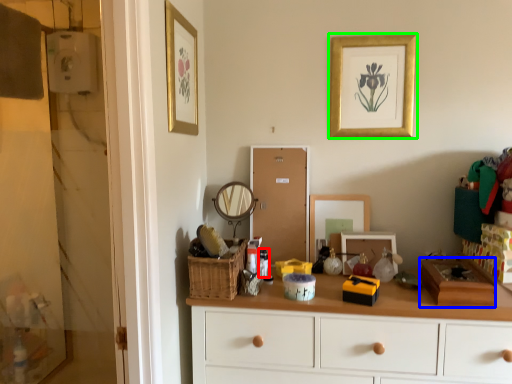
Question: Which is nearer to the toiletry (highlighted by a red box)? box (highlighted by a blue box) or picture frame (highlighted by a green box).

Choices:
 (A) box
 (B) picture frame

Answer: (A)